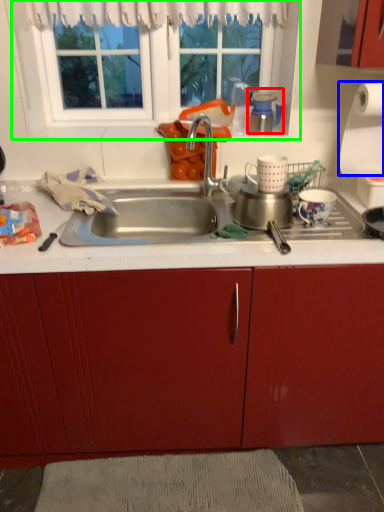
Question: Which object is positioned farthest from appliance (highlighted by a red box)? Select from paper towel (highlighted by a blue box) and window (highlighted by a green box).

Choices:
 (A) paper towel
 (B) window

Answer: (B)